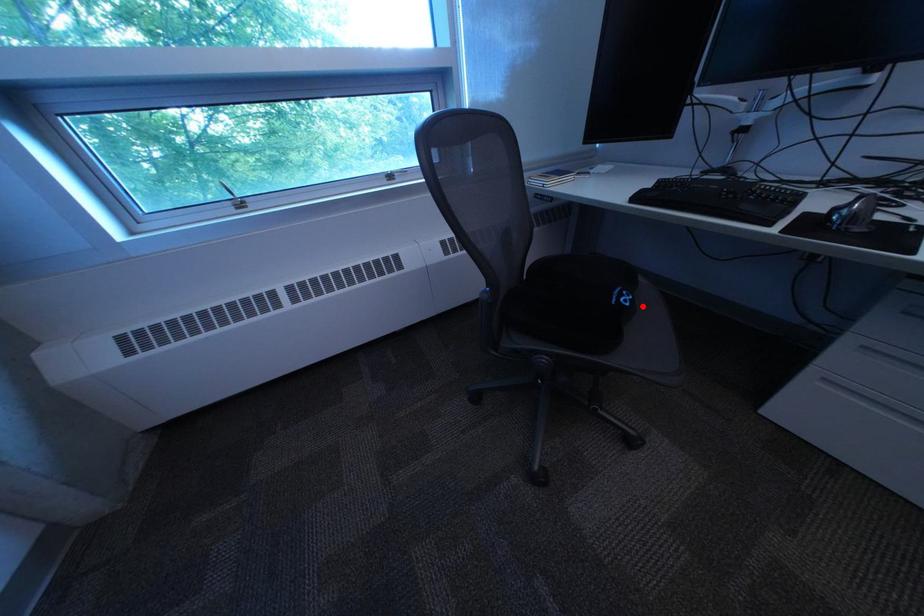
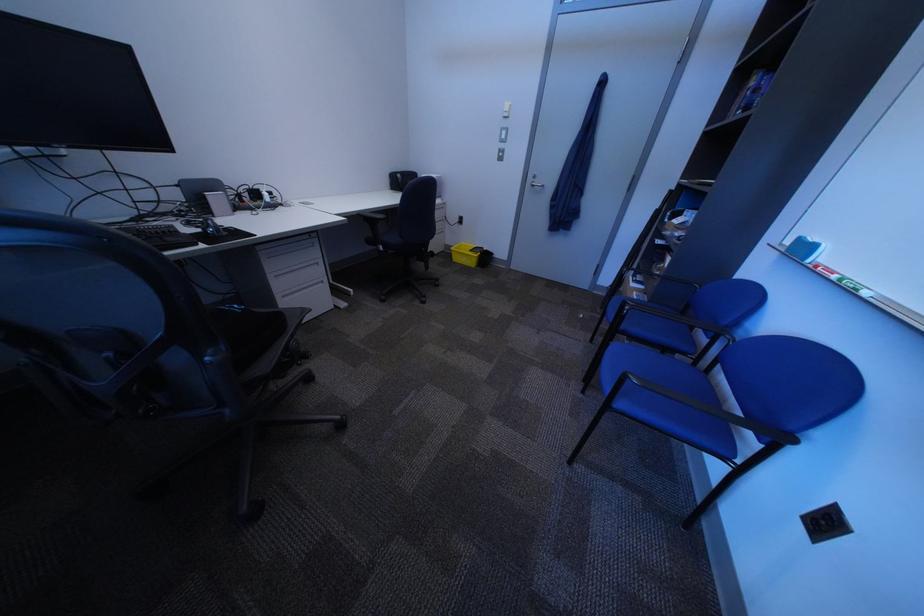
Question: A red point is marked in image1. In image2, is the corresponding 3D point closer to the camera or farther? Reply with the corresponding letter.

Choices:
 (A) The corresponding 3D point is closer.
 (B) The corresponding 3D point is farther.

Answer: (A)